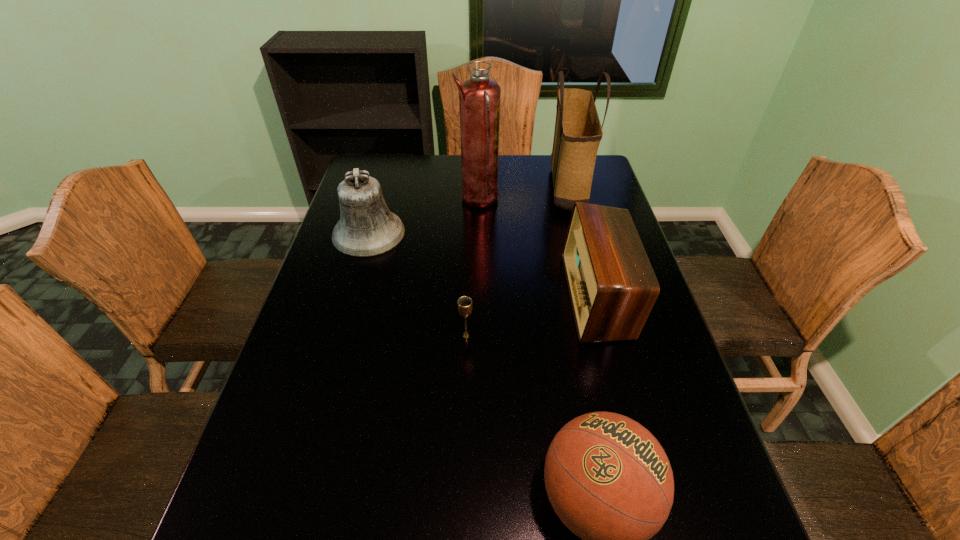
You are a GUI agent. You are given a task and a screenshot of the screen. Output one action in this format:
    pyautogui.click(x=<x>, y=<y>)
    Task: Click on the empty space that is in between the chalice and the radio receiver
    This screenshot has height=540, width=960.
    Given the screenshot: What is the action you would take?
    coord(532,316)

Locate an element on the screen. This screenshot has height=540, width=960. vacant point located between the bell and the radio receiver is located at coordinates (483, 265).

Find the location of a particular element. vacant point located between the bell and the fire extinguisher is located at coordinates (423, 217).

Locate an element on the screen. This screenshot has width=960, height=540. vacant point located between the fire extinguisher and the shortest object is located at coordinates (471, 268).

The height and width of the screenshot is (540, 960). What are the coordinates of `vacant space that is in between the fire extinguisher and the leftmost object` in the screenshot? It's located at (423, 217).

What are the coordinates of `blank region between the fire extinguisher and the bell` in the screenshot? It's located at (423, 217).

Where is `free space between the fire extinguisher and the tote bag`? This screenshot has height=540, width=960. free space between the fire extinguisher and the tote bag is located at coordinates pyautogui.click(x=522, y=193).

Find the location of a particular element. This screenshot has height=540, width=960. vacant space in between the shortest object and the radio receiver is located at coordinates (532, 316).

Locate which object is the fourth closest to the fire extinguisher. Please provide its 2D coordinates. Your answer should be formatted as a tuple, i.e. [(x, y)], where the tuple contains the x and y coordinates of a point satisfying the conditions above.

[(464, 304)]

Identify which object is located as the fourth nearest to the fire extinguisher. Please provide its 2D coordinates. Your answer should be formatted as a tuple, i.e. [(x, y)], where the tuple contains the x and y coordinates of a point satisfying the conditions above.

[(464, 304)]